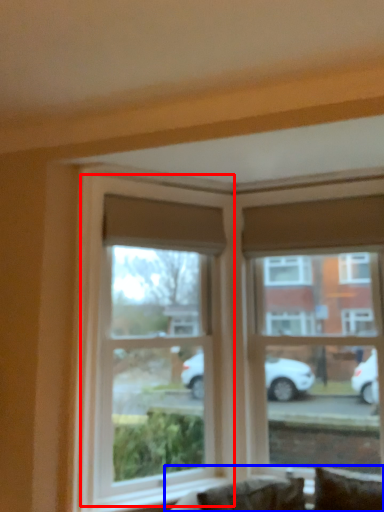
Question: Which of the following is the closest to the observer, window (highlighted by a red box) or couch (highlighted by a blue box)?

Choices:
 (A) window
 (B) couch

Answer: (B)